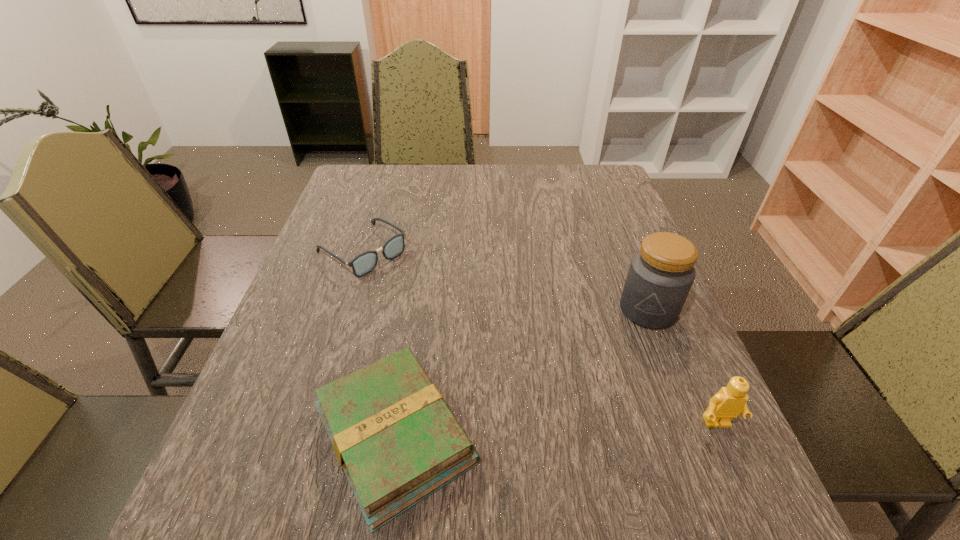
Find the location of a particular element. This screenshot has width=960, height=540. vacant area between the jar and the farthest object is located at coordinates (505, 280).

Locate an element on the screen. This screenshot has width=960, height=540. empty space that is in between the third nearest object and the spectacles is located at coordinates (505, 280).

Find the location of `vacant area that lies between the Lego and the jar`. vacant area that lies between the Lego and the jar is located at coordinates (683, 367).

I want to click on free space between the spectacles and the book, so click(379, 343).

The height and width of the screenshot is (540, 960). Identify the location of free space that is in between the farthest object and the tallest object. (505, 280).

Identify which object is located as the third nearest to the Lego. Please provide its 2D coordinates. Your answer should be formatted as a tuple, i.e. [(x, y)], where the tuple contains the x and y coordinates of a point satisfying the conditions above.

[(364, 263)]

Select which object is the third closest to the book. Please provide its 2D coordinates. Your answer should be formatted as a tuple, i.e. [(x, y)], where the tuple contains the x and y coordinates of a point satisfying the conditions above.

[(729, 402)]

The width and height of the screenshot is (960, 540). What are the coordinates of `free spot that satisfies the following two spatial constraints: 1. on the front side of the book; 2. on the left side of the farthest object` in the screenshot? It's located at (303, 436).

You are a GUI agent. You are given a task and a screenshot of the screen. Output one action in this format:
    pyautogui.click(x=<x>, y=<y>)
    Task: Click on the free space that satisfies the following two spatial constraints: 1. on the front side of the spectacles; 2. on the left side of the jar
    
    Given the screenshot: What is the action you would take?
    point(344,309)